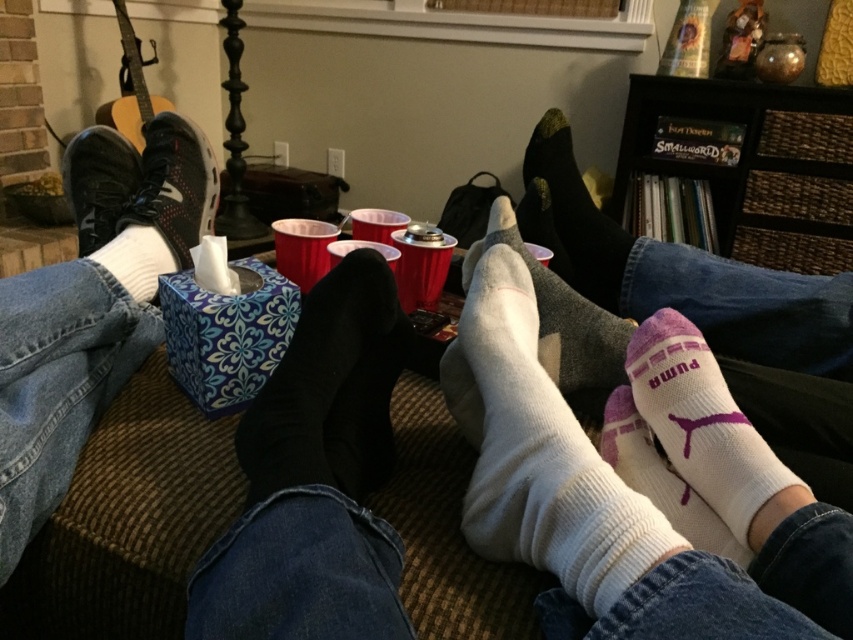
Question: Estimate the real-world distances between objects in this image. Which object is farther from the white textured sock at lower right?

Choices:
 (A) gray woolen sock at center
 (B) black fuzzy socks at center
 (C) blue floral tissue box at center
 (D) black fabric foot at center

Answer: (B)

Question: Considering the relative positions of white socks at left and white soft socks at lower left in the image provided, where is white socks at left located with respect to white soft socks at lower left?

Choices:
 (A) right
 (B) left

Answer: (B)

Question: Is white textured socks at lower right below black fabric foot at center?

Choices:
 (A) no
 (B) yes

Answer: (A)

Question: Among these objects, which one is farthest from the camera?

Choices:
 (A) white cotton socks at lower right
 (B) white ribbed sock at lower center
 (C) white socks at left

Answer: (C)

Question: Can you confirm if white socks at left is positioned to the right of white cotton socks at lower right?

Choices:
 (A) yes
 (B) no

Answer: (B)

Question: Which point appears farthest from the camera in this image?

Choices:
 (A) (16, 346)
 (B) (326, 333)
 (C) (621, 275)
 (D) (151, 278)

Answer: (C)